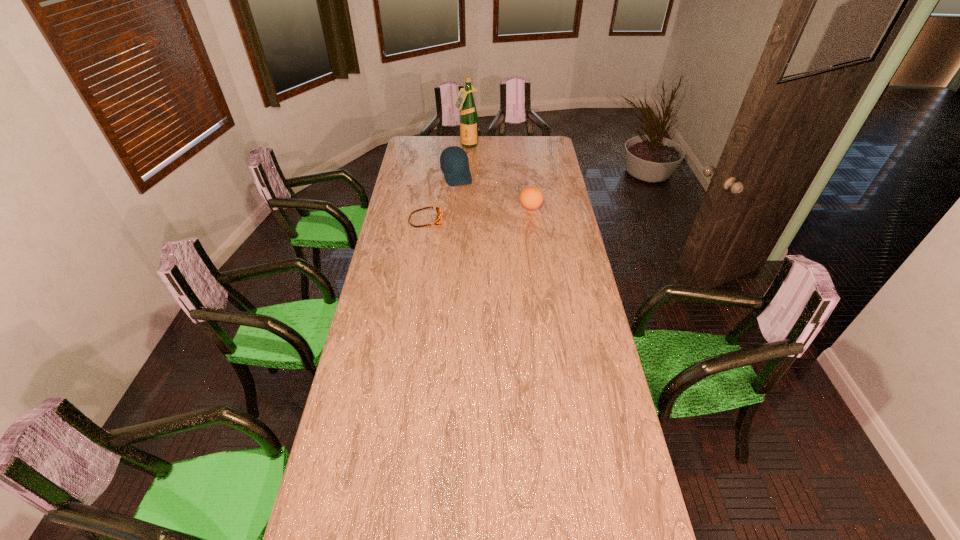
Find the location of `vacant region at the left edge`. vacant region at the left edge is located at coordinates (380, 399).

Where is `free space at the right edge of the desktop`? This screenshot has height=540, width=960. free space at the right edge of the desktop is located at coordinates (556, 231).

You are a GUI agent. You are given a task and a screenshot of the screen. Output one action in this format:
    pyautogui.click(x=<x>, y=<y>)
    Task: Click on the free point between the orange and the goggles
    
    Given the screenshot: What is the action you would take?
    pyautogui.click(x=478, y=214)

At what (x,y) coordinates should I click in order to perform the action: click on free space that is in between the farthest object and the second shortest object. Please return your answer as a coordinate pair (x, y). This screenshot has width=960, height=540. Looking at the image, I should click on (499, 177).

Locate an element on the screen. vacant space that is in between the third nearest object and the goggles is located at coordinates (441, 198).

Where is `vacant space in between the rightmost object and the liquor`? vacant space in between the rightmost object and the liquor is located at coordinates (499, 177).

The image size is (960, 540). In order to click on vacant region between the rightmost object and the shortest object in this screenshot , I will do `click(478, 214)`.

Image resolution: width=960 pixels, height=540 pixels. Find the location of `free point between the goggles and the orange`. free point between the goggles and the orange is located at coordinates (478, 214).

This screenshot has width=960, height=540. What are the coordinates of `free space between the orange and the tallest object` in the screenshot? It's located at (499, 177).

Identify the location of object that can be found as the closest to the second farthest object. The image size is (960, 540). (465, 102).